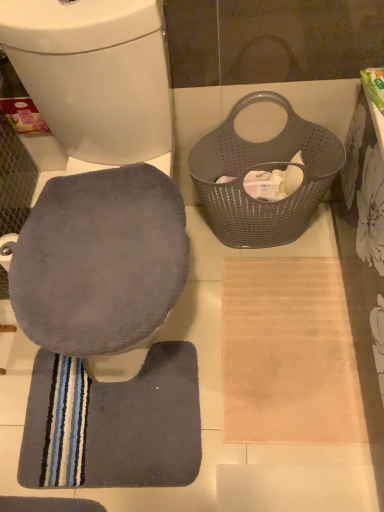
Question: Is dark gray plush bath mat at lower left directly adjacent to gray perforated laundry basket at upper right?

Choices:
 (A) no
 (B) yes

Answer: (A)

Question: Is dark gray plush bath mat at lower left not inside gray perforated laundry basket at upper right?

Choices:
 (A) yes
 (B) no

Answer: (A)

Question: Is dark gray plush bath mat at lower left further to camera compared to gray perforated laundry basket at upper right?

Choices:
 (A) no
 (B) yes

Answer: (B)

Question: Is dark gray plush bath mat at lower left to the left of gray perforated laundry basket at upper right from the viewer's perspective?

Choices:
 (A) yes
 (B) no

Answer: (A)

Question: Can you confirm if dark gray plush bath mat at lower left is shorter than gray perforated laundry basket at upper right?

Choices:
 (A) no
 (B) yes

Answer: (B)

Question: Is the position of dark gray plush bath mat at lower left less distant than that of gray perforated laundry basket at upper right?

Choices:
 (A) no
 (B) yes

Answer: (A)

Question: Is there a large distance between gray perforated laundry basket at upper right and gray fabric toilet seat at lower left?

Choices:
 (A) yes
 (B) no

Answer: (B)

Question: Does gray perforated laundry basket at upper right have a lesser height compared to gray fabric toilet seat at lower left?

Choices:
 (A) no
 (B) yes

Answer: (B)

Question: Is the position of gray perforated laundry basket at upper right less distant than that of gray fabric toilet seat at lower left?

Choices:
 (A) yes
 (B) no

Answer: (B)

Question: Is gray perforated laundry basket at upper right smaller than gray fabric toilet seat at lower left?

Choices:
 (A) no
 (B) yes

Answer: (B)

Question: Is gray fabric toilet seat at lower left inside gray perforated laundry basket at upper right?

Choices:
 (A) no
 (B) yes

Answer: (A)

Question: From a real-world perspective, is gray perforated laundry basket at upper right located higher than gray fabric toilet seat at lower left?

Choices:
 (A) yes
 (B) no

Answer: (B)

Question: Considering the relative sizes of gray fabric toilet seat at lower left and dark gray plush bath mat at lower left in the image provided, is gray fabric toilet seat at lower left shorter than dark gray plush bath mat at lower left?

Choices:
 (A) no
 (B) yes

Answer: (A)